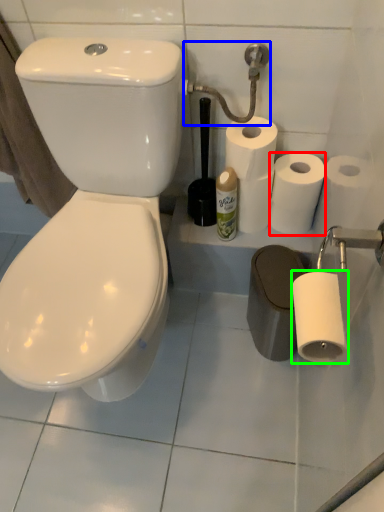
Question: Estimate the real-world distances between objects in this image. Which object is closer to toilet paper (highlighted by a red box), shower (highlighted by a blue box) or toilet paper (highlighted by a green box)?

Choices:
 (A) shower
 (B) toilet paper

Answer: (A)